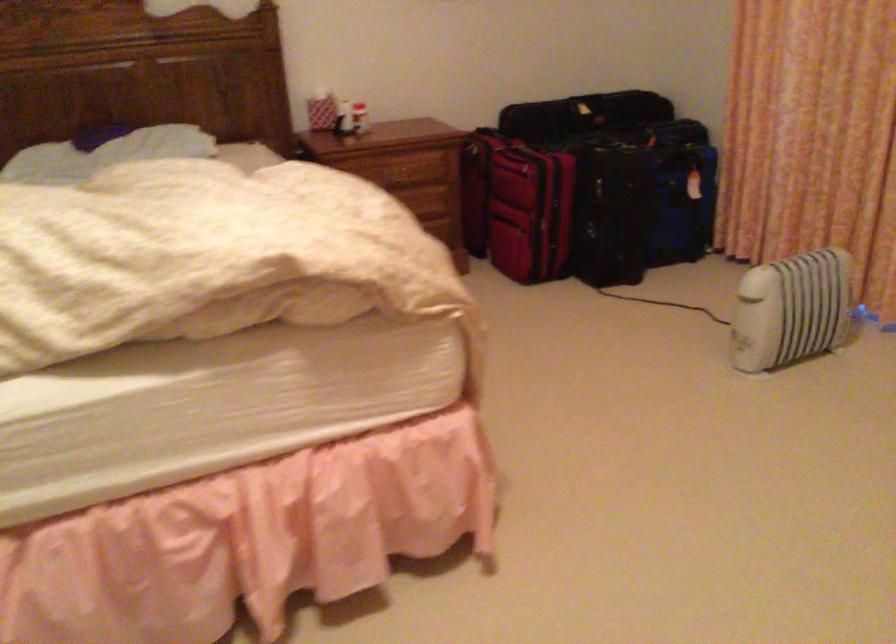
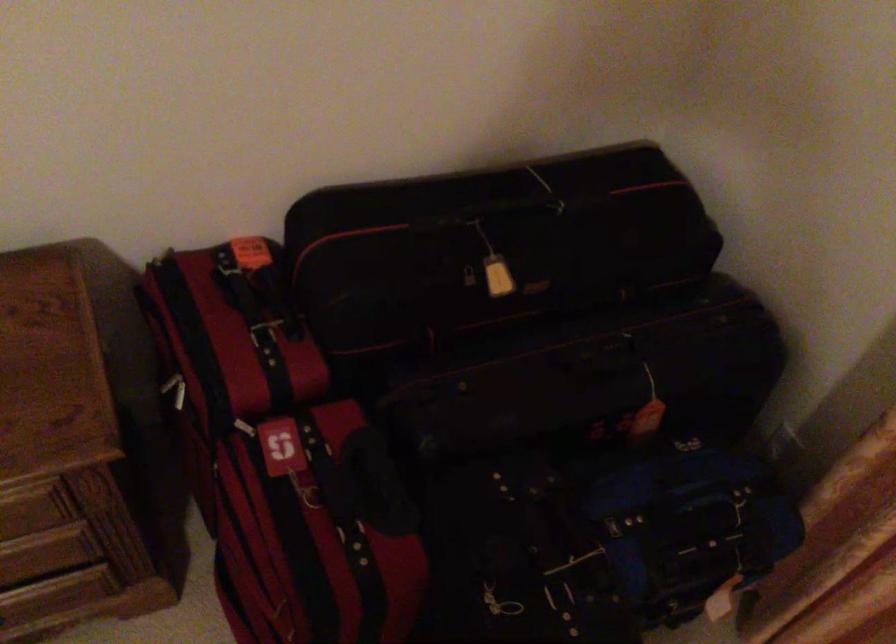
Where in the second image is the point corresponding to [659,136] from the first image?

(676, 507)